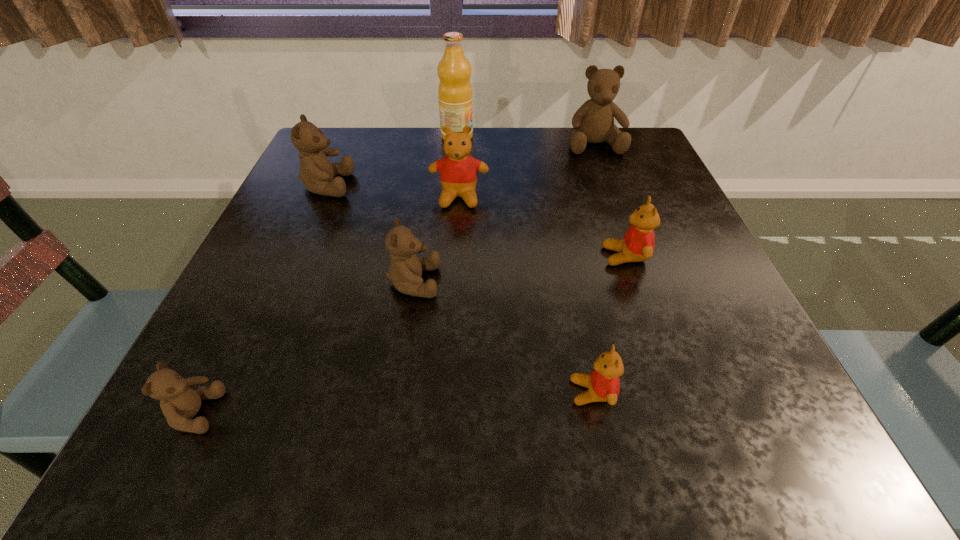
Locate an element on the screen. vacant region located 0.110m on the front-facing side of the second brown teddy bear from right to left is located at coordinates (503, 282).

Find the location of `free space located on the front-facing side of the fifth teddy bear from left to right`. free space located on the front-facing side of the fifth teddy bear from left to right is located at coordinates (x=441, y=392).

The width and height of the screenshot is (960, 540). Find the location of `free location located 0.060m on the front-facing side of the fifth teddy bear from left to right`. free location located 0.060m on the front-facing side of the fifth teddy bear from left to right is located at coordinates (528, 392).

Locate an element on the screen. The image size is (960, 540). vacant space located on the front-facing side of the fifth teddy bear from left to right is located at coordinates (448, 392).

Where is `free space located 0.310m on the front-facing side of the smallest brown teddy bear`? free space located 0.310m on the front-facing side of the smallest brown teddy bear is located at coordinates (453, 413).

Identify the location of fruit juice located at the far edge. The height and width of the screenshot is (540, 960). (455, 95).

You are a GUI agent. You are given a task and a screenshot of the screen. Output one action in this format:
    pyautogui.click(x=<x>, y=<y>)
    Task: Click on the object present at the far left corner
    The image size is (960, 540).
    Given the screenshot: What is the action you would take?
    pyautogui.click(x=316, y=171)

Find the location of a particular element. The image size is (960, 540). object present at the near left corner is located at coordinates click(179, 403).

Locate an element on the screen. object at the far right corner is located at coordinates (593, 122).

I want to click on vacant space at the far edge, so click(495, 148).